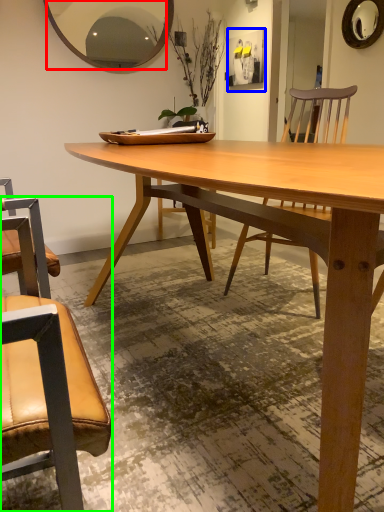
Question: Based on their relative distances, which object is farther from mirror (highlighted by a red box)? Choose from picture frame (highlighted by a blue box) and chair (highlighted by a green box).

Choices:
 (A) picture frame
 (B) chair

Answer: (A)